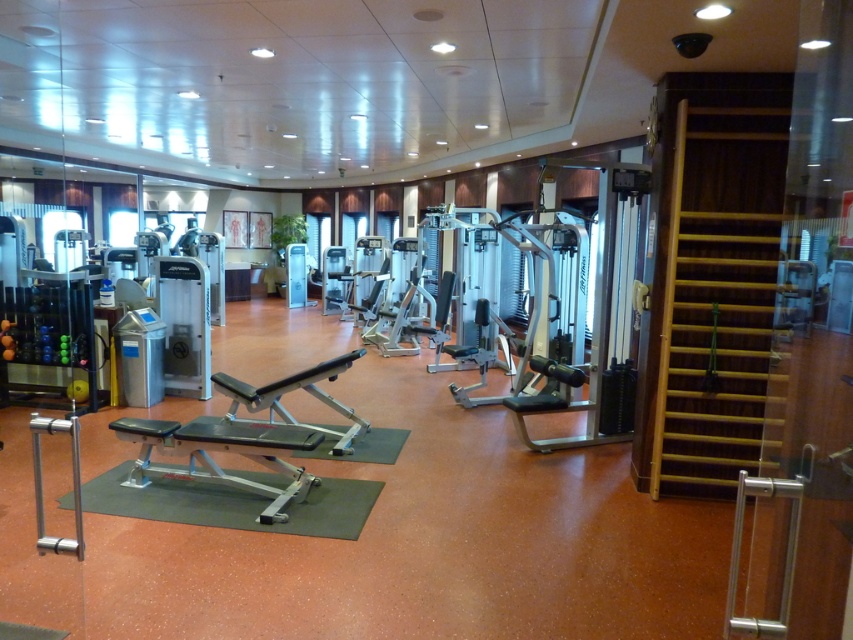
Question: In this image, where is silver metallic bench at center located relative to green rubber mat at center?

Choices:
 (A) below
 (B) above

Answer: (B)

Question: Which point appears farthest from the camera in this image?

Choices:
 (A) (289, 476)
 (B) (170, 474)

Answer: (B)

Question: Is silver metallic bench at center to the right of green rubber mat at center from the viewer's perspective?

Choices:
 (A) no
 (B) yes

Answer: (A)

Question: Is silver metallic bench at center bigger than green rubber mat at center?

Choices:
 (A) yes
 (B) no

Answer: (A)

Question: Among these points, which one is nearest to the camera?

Choices:
 (A) (257, 458)
 (B) (189, 499)

Answer: (B)